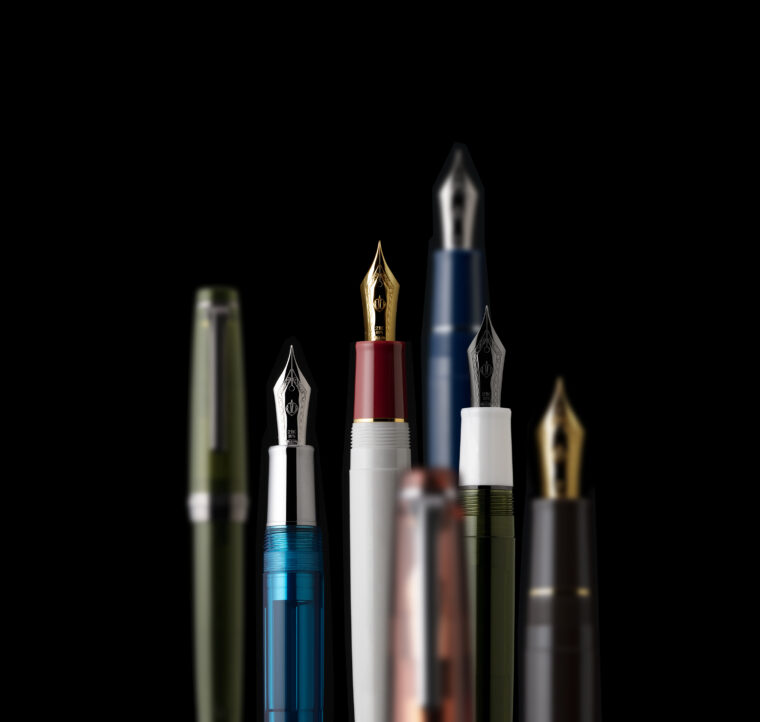
Locate an element on the screen. Image resolution: width=760 pixels, height=722 pixels. pens without cap is located at coordinates (299, 422), (381, 310), (458, 235), (492, 367), (561, 458).